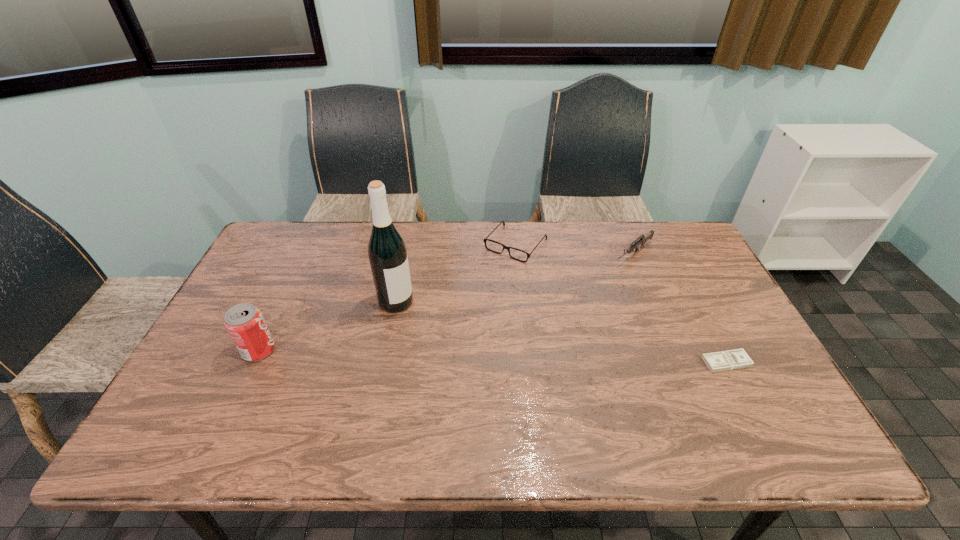
At what (x,y) coordinates should I click in order to perform the action: click on vacant space on the desktop that is between the fourth shortest object and the money and is positioned on the front-facing side of the spectacles. Please return your answer as a coordinate pair (x, y). This screenshot has height=540, width=960. Looking at the image, I should click on (425, 354).

Find the location of `free spot on the desktop that is between the fourth shortest object and the shortest object and is positioned on the label of the fourth object from right to left`. free spot on the desktop that is between the fourth shortest object and the shortest object and is positioned on the label of the fourth object from right to left is located at coordinates (470, 355).

This screenshot has height=540, width=960. Find the location of `free space on the desktop that is between the soda can and the shortest object and is positioned aimed along the barrel of the third shortest object`. free space on the desktop that is between the soda can and the shortest object and is positioned aimed along the barrel of the third shortest object is located at coordinates (502, 356).